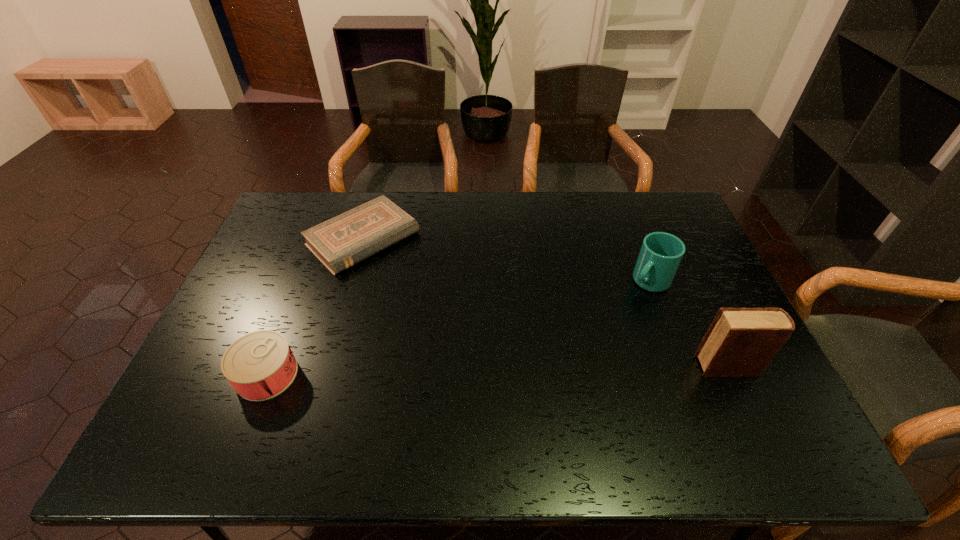
Find the location of a particular element. This screenshot has width=960, height=540. can is located at coordinates pos(260,365).

Where is `the tallest object`? The width and height of the screenshot is (960, 540). the tallest object is located at coordinates (740, 342).

I want to click on Bible, so click(x=347, y=239).

Identify the location of cup. The height and width of the screenshot is (540, 960). (661, 253).

You are a GUI agent. You are given a task and a screenshot of the screen. Output one action in this format:
    pyautogui.click(x=<x>, y=<y>)
    Task: Click on the vacant region located 0.400m on the back of the can
    
    Given the screenshot: What is the action you would take?
    pyautogui.click(x=316, y=249)

The height and width of the screenshot is (540, 960). Identify the location of free space located 0.190m on the spine side of the Bible. (432, 301).

Where is `vacant region located on the spine side of the Bible`? This screenshot has width=960, height=540. vacant region located on the spine side of the Bible is located at coordinates (462, 327).

You are a GUI agent. You are given a task and a screenshot of the screen. Output one action in this format:
    pyautogui.click(x=<x>, y=<y>)
    Task: Click on the vacant space located 0.140m on the spine side of the Bible
    This screenshot has width=960, height=540.
    Given the screenshot: What is the action you would take?
    coord(422,292)

The width and height of the screenshot is (960, 540). I want to click on vacant space located on the handle side of the cup, so click(x=589, y=340).

Identify the location of vacant space located 0.120m on the handle side of the cup. This screenshot has height=540, width=960. (616, 314).